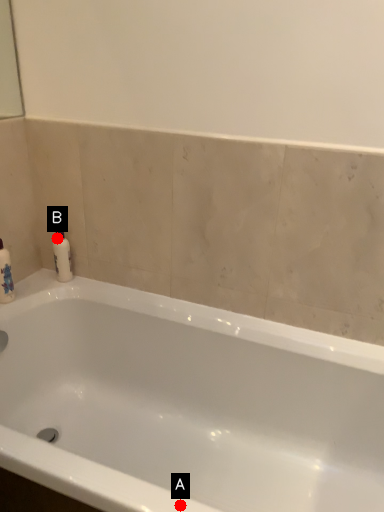
Question: Two points are circled on the image, labeled by A and B beside each circle. Which point is farther to the camera?

Choices:
 (A) A is further
 (B) B is further

Answer: (B)